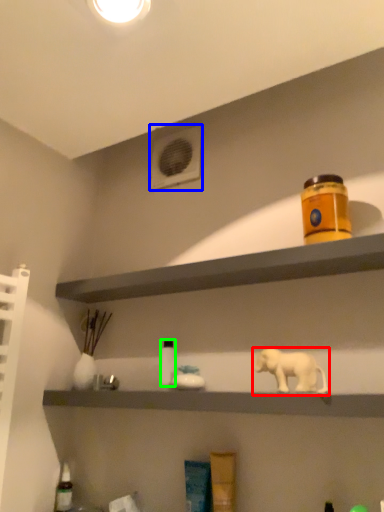
Question: Considering the real-world distances, which object is farthest from elephant (highlighted by a red box)? air conditioning (highlighted by a blue box) or bottle (highlighted by a green box)?

Choices:
 (A) air conditioning
 (B) bottle

Answer: (A)